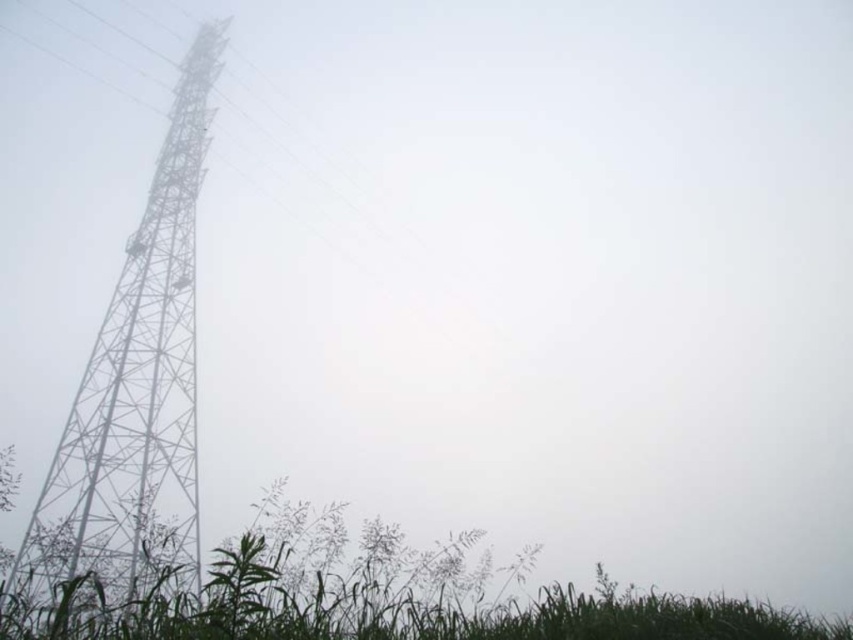
You are a gardener trying to mow the lawn. You see two areas of green grassy at lower left and green grass at lower left. Which area is wider?

The green grassy at lower left is wider than the green grass at lower left according to the description.

Based on the photo, you are a photographer trying to capture the metallic tower at left and the green grassy at lower left in the same frame. Based on their positions, can you determine which object is higher in the image?

The metallic tower at left is located above the green grassy at lower left, so the metallic tower at left is higher in the image.